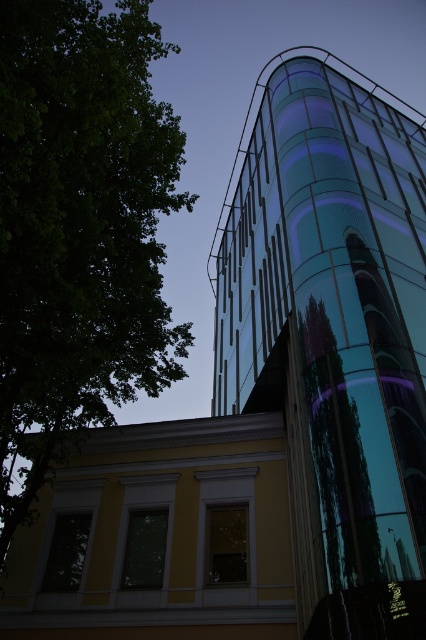
Does transparent glass tower at upper right appear on the right side of green leafy tree at left?

Indeed, transparent glass tower at upper right is positioned on the right side of green leafy tree at left.

Is transparent glass tower at upper right smaller than green leafy tree at left?

No, transparent glass tower at upper right is not smaller than green leafy tree at left.

Image resolution: width=426 pixels, height=640 pixels. I want to click on transparent glass tower at upper right, so click(x=333, y=336).